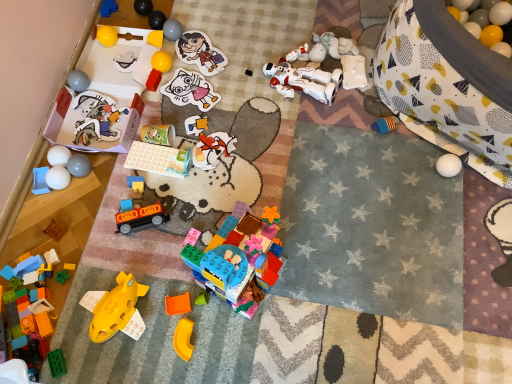
Question: Is shiny yellow ball at center, marked as the 22th toy in a bottom-to-top arrangement, wider than matte green cup at center, which ranks as the 15th toy in bottom-to-top order?

Choices:
 (A) yes
 (B) no

Answer: (B)

Question: Does shiny yellow ball at center, the sixth toy from the top, have a larger size compared to matte green cup at center, the 13th toy viewed from the top?

Choices:
 (A) no
 (B) yes

Answer: (A)

Question: Is shiny yellow ball at center, the sixth toy from the top, oriented away from matte green cup at center, which ranks as the 15th toy in bottom-to-top order?

Choices:
 (A) no
 (B) yes

Answer: (A)

Question: Does shiny yellow ball at center, marked as the 22th toy in a bottom-to-top arrangement, have a greater height compared to matte green cup at center, the 13th toy viewed from the top?

Choices:
 (A) yes
 (B) no

Answer: (B)

Question: Considering the relative positions of shiny yellow ball at center, the sixth toy from the top, and matte green cup at center, which ranks as the 15th toy in bottom-to-top order, in the image provided, is shiny yellow ball at center, the sixth toy from the top, to the right of matte green cup at center, which ranks as the 15th toy in bottom-to-top order, from the viewer's perspective?

Choices:
 (A) no
 (B) yes

Answer: (A)

Question: Is shiny yellow ball at center, marked as the 22th toy in a bottom-to-top arrangement, closer to camera compared to matte green cup at center, the 13th toy viewed from the top?

Choices:
 (A) no
 (B) yes

Answer: (A)

Question: Can you see yellow plastic arch at lower center, which ranks as the 1th toy in bottom-to-top order, touching matte gray ball at upper left, the eighteenth toy ordered from the bottom?

Choices:
 (A) yes
 (B) no

Answer: (B)

Question: Does yellow plastic arch at lower center, placed as the 27th toy when sorted from top to bottom, have a smaller size compared to matte gray ball at upper left, the eighteenth toy ordered from the bottom?

Choices:
 (A) no
 (B) yes

Answer: (B)

Question: Could you tell me if yellow plastic arch at lower center, placed as the 27th toy when sorted from top to bottom, is facing matte gray ball at upper left, the eighteenth toy ordered from the bottom?

Choices:
 (A) no
 (B) yes

Answer: (A)

Question: Is matte gray ball at upper left, the eighteenth toy ordered from the bottom, at the back of yellow plastic arch at lower center, placed as the 27th toy when sorted from top to bottom?

Choices:
 (A) yes
 (B) no

Answer: (B)

Question: Considering the relative sizes of yellow plastic arch at lower center, placed as the 27th toy when sorted from top to bottom, and matte gray ball at upper left, which is counted as the tenth toy, starting from the top, in the image provided, is yellow plastic arch at lower center, placed as the 27th toy when sorted from top to bottom, taller than matte gray ball at upper left, which is counted as the tenth toy, starting from the top,?

Choices:
 (A) no
 (B) yes

Answer: (A)

Question: Would you say yellow plastic arch at lower center, placed as the 27th toy when sorted from top to bottom, is a long distance from matte gray ball at upper left, which is counted as the tenth toy, starting from the top?

Choices:
 (A) yes
 (B) no

Answer: (B)

Question: From a real-world perspective, is yellow plastic arch at lower center, placed as the 27th toy when sorted from top to bottom, positioned over blue plastic tray at lower left, placed as the 10th toy when sorted from bottom to top, based on gravity?

Choices:
 (A) yes
 (B) no

Answer: (A)